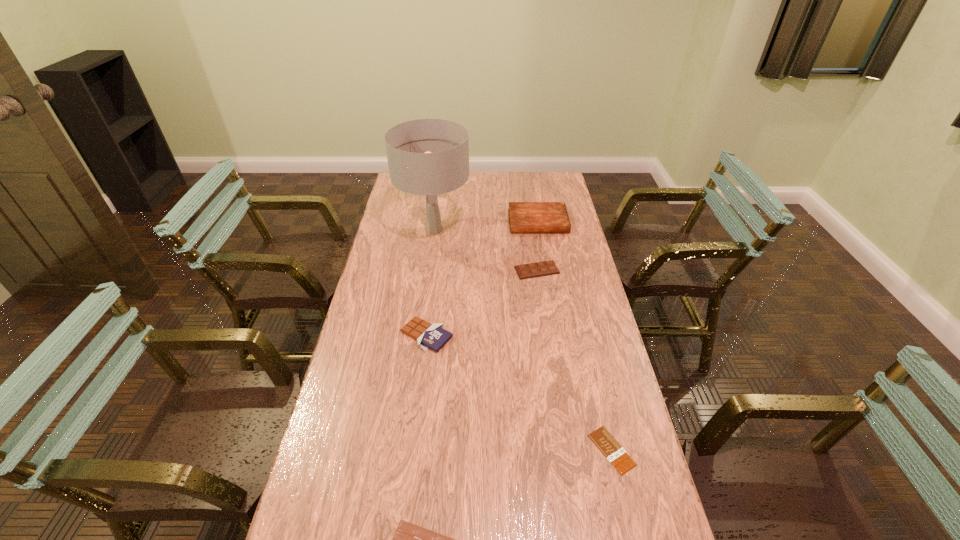
Where is `lampshade`? The height and width of the screenshot is (540, 960). lampshade is located at coordinates (429, 157).

At what (x,y) coordinates should I click in order to perform the action: click on the fifth shortest object. Please return your answer as a coordinate pair (x, y). This screenshot has width=960, height=540. Looking at the image, I should click on (524, 217).

This screenshot has height=540, width=960. In order to click on the third tallest object in this screenshot , I will do `click(433, 336)`.

Identify the location of the second farthest chocolate bar. This screenshot has height=540, width=960. (433, 336).

The height and width of the screenshot is (540, 960). I want to click on the fourth tallest object, so click(x=545, y=268).

Identify the location of the third farthest object. The image size is (960, 540). (545, 268).

Where is `the second nearest chocolate bar`? the second nearest chocolate bar is located at coordinates (611, 449).

Identify the location of the shortest object. (611, 449).

I want to click on vacant space located 0.240m on the front-facing side of the tallest object, so click(x=526, y=230).

Locate an element on the screen. The width and height of the screenshot is (960, 540). vacant area situated 0.050m on the spine side of the Bible is located at coordinates (541, 241).